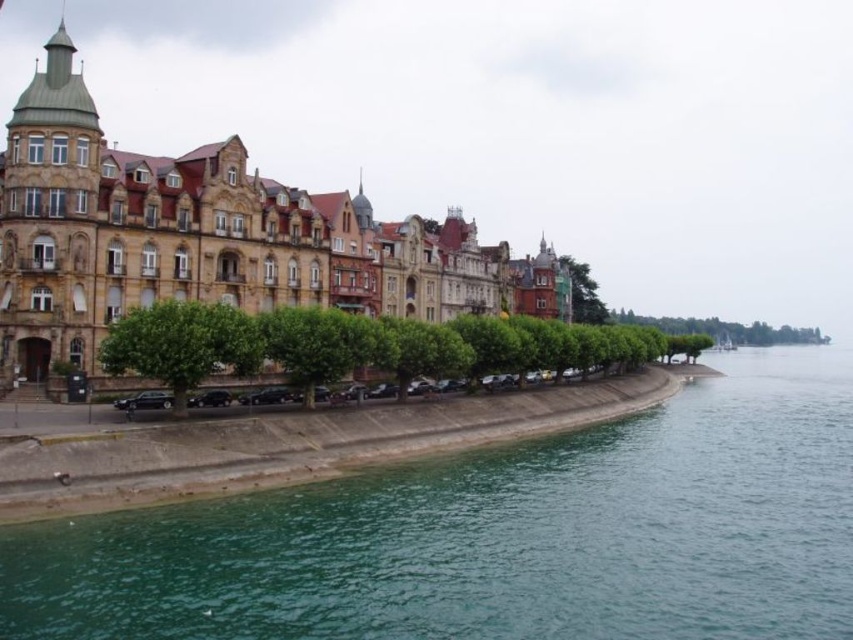
Looking at this image, can you confirm if green water at lower left is taller than green leafy trees at center?

In fact, green water at lower left may be shorter than green leafy trees at center.

Does point (610, 452) come farther from viewer compared to point (532, 360)?

No, (610, 452) is closer to viewer.

The image size is (853, 640). What do you see at coordinates (498, 536) in the screenshot? I see `green water at lower left` at bounding box center [498, 536].

Where is `green water at lower left`? The height and width of the screenshot is (640, 853). green water at lower left is located at coordinates (498, 536).

How far apart are smooth concrete embankment at lower left and green leafy tree at center?

smooth concrete embankment at lower left is 10.70 meters away from green leafy tree at center.

Does point (64, 444) lie behind point (117, 344)?

No, it is in front of (117, 344).

This screenshot has height=640, width=853. Find the location of `smooth concrete embankment at lower left`. smooth concrete embankment at lower left is located at coordinates (289, 445).

Is point (735, 433) closer to viewer compared to point (189, 330)?

No, (735, 433) is further to viewer.

Between green water at lower left and green leafy tree at center, which one is positioned higher?

green leafy tree at center

The image size is (853, 640). I want to click on green water at lower left, so click(x=498, y=536).